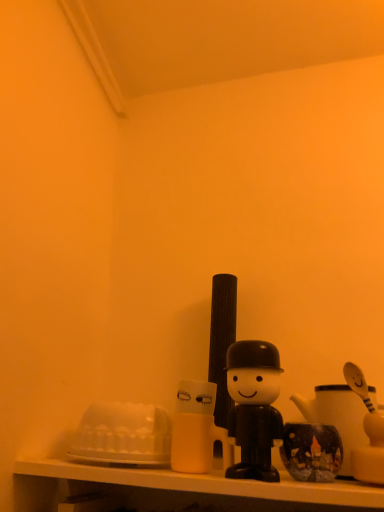
This screenshot has width=384, height=512. What do you see at coordinates (178, 490) in the screenshot?
I see `white glossy shelf at lower center` at bounding box center [178, 490].

What are the coordinates of `white glossy shelf at lower center` in the screenshot? It's located at (178, 490).

Image resolution: width=384 pixels, height=512 pixels. Identify the location of black matte toy at center. (254, 407).

What do you see at coordinates (254, 407) in the screenshot? I see `black matte toy at center` at bounding box center [254, 407].

You are a GUI agent. You are given a task and a screenshot of the screen. Output one action in this format:
    pyautogui.click(x=<x>, y=<y>)
    Task: Click on the white glossy shelf at lower center
    Image resolution: width=384 pixels, height=512 pixels.
    Given the screenshot: What is the action you would take?
    pyautogui.click(x=178, y=490)

Can you confirm if white glossy shelf at lower center is positioned to the left of black matte toy at center?

Indeed, white glossy shelf at lower center is positioned on the left side of black matte toy at center.

Which object is closer to the camera, white glossy shelf at lower center or black matte toy at center?

white glossy shelf at lower center is more forward.

Is point (167, 495) positioned before point (258, 419)?

No.

From the image's perspective, does white glossy shelf at lower center appear lower than black matte toy at center?

Yes, from the image's perspective, white glossy shelf at lower center is beneath black matte toy at center.

From a real-world perspective, which is physically above, white glossy shelf at lower center or black matte toy at center?

black matte toy at center.

Considering the sizes of objects white glossy shelf at lower center and black matte toy at center in the image provided, who is thinner, white glossy shelf at lower center or black matte toy at center?

Thinner between the two is black matte toy at center.

In terms of height, does white glossy shelf at lower center look taller or shorter compared to black matte toy at center?

Clearly, white glossy shelf at lower center is shorter compared to black matte toy at center.

Based on the photo, considering the sizes of objects white glossy shelf at lower center and black matte toy at center in the image provided, who is bigger, white glossy shelf at lower center or black matte toy at center?

Bigger between the two is white glossy shelf at lower center.

Can we say white glossy shelf at lower center lies outside black matte toy at center?

white glossy shelf at lower center lies outside black matte toy at center's area.

Are white glossy shelf at lower center and black matte toy at center making contact?

They are not placed beside each other.

Is white glossy shelf at lower center oriented towards black matte toy at center?

No, white glossy shelf at lower center is not aimed at black matte toy at center.

Find the location of `shelf below the black matte toy at center (from a real-world perspective)`. shelf below the black matte toy at center (from a real-world perspective) is located at coordinates (178, 490).

From the picture: Which object is positioned more to the left, black matte toy at center or white glossy shelf at lower center?

Positioned to the left is white glossy shelf at lower center.

Which object is closer to the camera, black matte toy at center or white glossy shelf at lower center?

white glossy shelf at lower center is closer to the camera.

Which point is more distant from viewer, (247, 465) or (20, 490)?

The point (20, 490) is farther.

From the image's perspective, relative to white glossy shelf at lower center, is black matte toy at center above or below?

black matte toy at center is situated higher than white glossy shelf at lower center in the image.

From a real-world perspective, does black matte toy at center sit lower than white glossy shelf at lower center?

No, from a real-world perspective, black matte toy at center is not under white glossy shelf at lower center.

Between black matte toy at center and white glossy shelf at lower center, which one has smaller width?

black matte toy at center is thinner.

Who is taller, black matte toy at center or white glossy shelf at lower center?

black matte toy at center.

Does black matte toy at center have a larger size compared to white glossy shelf at lower center?

No, black matte toy at center is not bigger than white glossy shelf at lower center.

From the picture: Can we say black matte toy at center lies outside white glossy shelf at lower center?

Yes, black matte toy at center is not within white glossy shelf at lower center.

Is the surface of black matte toy at center in direct contact with white glossy shelf at lower center?

No, black matte toy at center is not with white glossy shelf at lower center.

Is black matte toy at center turned away from white glossy shelf at lower center?

No, black matte toy at center is not facing the opposite direction of white glossy shelf at lower center.

How many degrees apart are the facing directions of black matte toy at center and white glossy shelf at lower center?

The facing directions of black matte toy at center and white glossy shelf at lower center are 1.64 degrees apart.

You are a GUI agent. You are given a task and a screenshot of the screen. Output one action in this format:
    pyautogui.click(x=<x>, y=<y>)
    Task: Click on the toy on the right of the white glossy shelf at lower center
    The height and width of the screenshot is (512, 384).
    Given the screenshot: What is the action you would take?
    pyautogui.click(x=254, y=407)

Locate an element on the screen. This screenshot has width=384, height=512. shelf below the black matte toy at center (from a real-world perspective) is located at coordinates (178, 490).

What are the coordinates of `toy that is on the right side of white glossy shelf at lower center` in the screenshot? It's located at (254, 407).